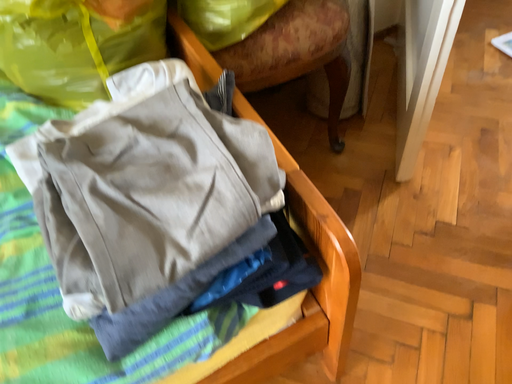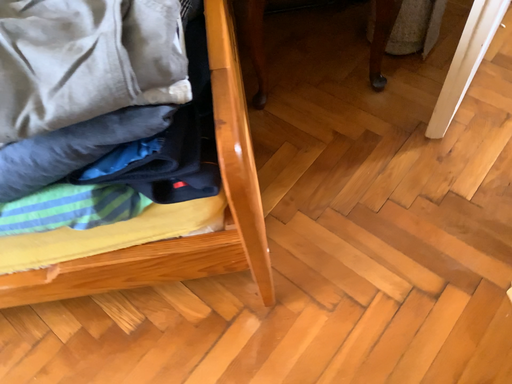
Question: How did the camera likely rotate when shooting the video?

Choices:
 (A) rotated downward
 (B) rotated upward

Answer: (A)